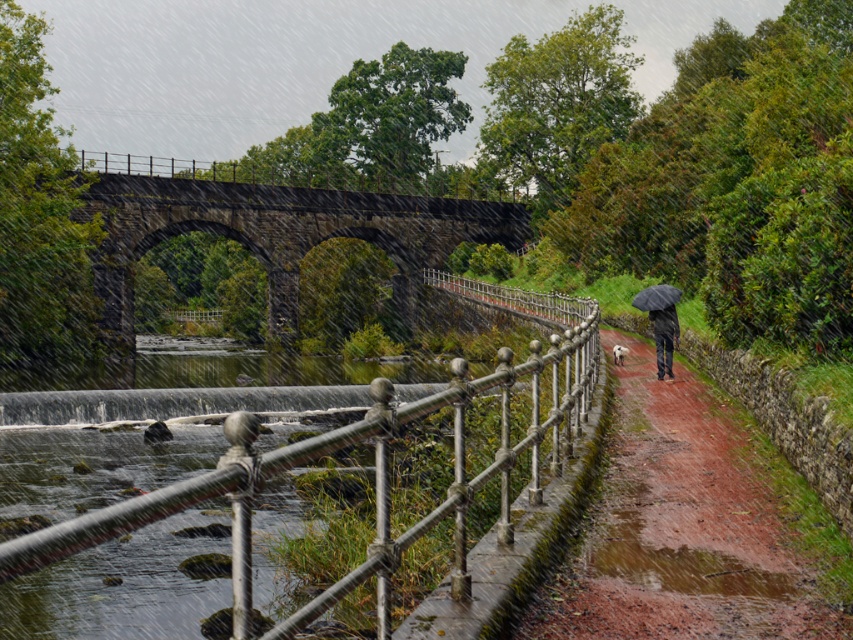
Question: Does damp brick path at center appear on the left side of black matte umbrella at center-right?

Choices:
 (A) yes
 (B) no

Answer: (A)

Question: Which object appears closest to the camera in this image?

Choices:
 (A) damp brick path at center
 (B) dark gray jeans at center-right
 (C) silver metallic railing at center
 (D) black matte umbrella at center-right

Answer: (C)

Question: Which point is closer to the camera taking this photo?

Choices:
 (A) (346, 211)
 (B) (572, 573)
 (C) (659, 324)
 (D) (245, 570)

Answer: (D)

Question: Is silver metallic railing at center thinner than dark gray jeans at center-right?

Choices:
 (A) yes
 (B) no

Answer: (B)

Question: Can you confirm if damp brick path at center is smaller than black matte umbrella at center-right?

Choices:
 (A) yes
 (B) no

Answer: (B)

Question: Which object appears closest to the camera in this image?

Choices:
 (A) dark stone bridge at upper center
 (B) black matte umbrella at center-right

Answer: (B)